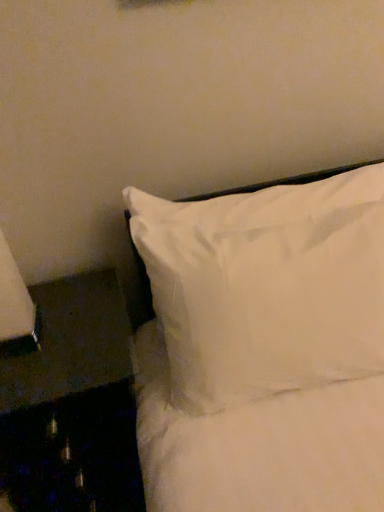
Question: In the image, is white soft pillow at upper right positioned in front of or behind black fabric side table at lower left?

Choices:
 (A) behind
 (B) front

Answer: (B)

Question: From the image's perspective, is white soft pillow at upper right located above or below black fabric side table at lower left?

Choices:
 (A) above
 (B) below

Answer: (A)

Question: From a real-world perspective, is white soft pillow at upper right positioned above or below black fabric side table at lower left?

Choices:
 (A) above
 (B) below

Answer: (A)

Question: Considering the positions of black fabric side table at lower left and white soft pillow at upper right in the image, is black fabric side table at lower left wider or thinner than white soft pillow at upper right?

Choices:
 (A) wide
 (B) thin

Answer: (A)

Question: In the image, is black fabric side table at lower left on the left side or the right side of white soft pillow at upper right?

Choices:
 (A) right
 (B) left

Answer: (B)

Question: Relative to white soft pillow at upper right, is black fabric side table at lower left in front or behind?

Choices:
 (A) front
 (B) behind

Answer: (B)

Question: Which is correct: black fabric side table at lower left is inside white soft pillow at upper right, or outside of it?

Choices:
 (A) inside
 (B) outside

Answer: (B)